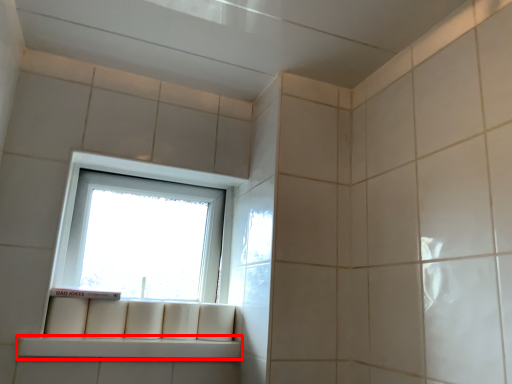
Question: Considering the relative positions of window sill (annotated by the red box) and window in the image provided, where is window sill (annotated by the red box) located with respect to the staircase?

Choices:
 (A) left
 (B) right

Answer: (A)